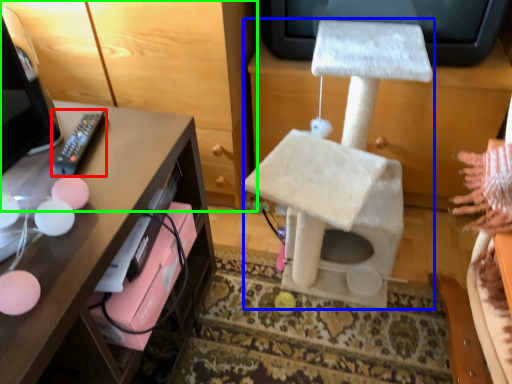
Question: Based on their relative distances, which object is farther from remote (highlighted by a red box)? Choose from swivel chair (highlighted by a blue box) and furniture (highlighted by a green box).

Choices:
 (A) swivel chair
 (B) furniture

Answer: (A)